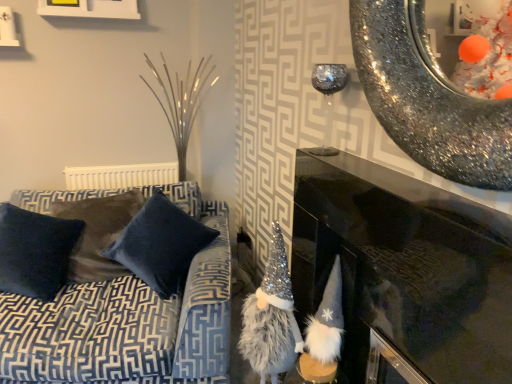
The width and height of the screenshot is (512, 384). Describe the element at coordinates (324, 333) in the screenshot. I see `white fluffy gnome at lower right` at that location.

In order to face velvet blue pillow at center, which is the 2th pillow from left to right, should I rotate leftwards or rightwards?

Turn left approximately 11.886 degrees to face it.

What do you see at coordinates (271, 318) in the screenshot? I see `fuzzy silver gnome at center` at bounding box center [271, 318].

I want to click on white plastic radiator at upper center, so click(x=120, y=176).

This screenshot has height=384, width=512. What are the coordinates of `sparkly metallic bowl at upper right` in the screenshot? It's located at (426, 98).

Is velvet dark blue pillow at left, the first pillow in the left-to-right sequence, bigger than velvet blue pillow at center, which is the 2th pillow from left to right?

No, velvet dark blue pillow at left, the first pillow in the left-to-right sequence, is not bigger than velvet blue pillow at center, which is the 2th pillow from left to right.

Is point (29, 231) farther from viewer compared to point (106, 253)?

That is False.

From a real-world perspective, is velvet dark blue pillow at left, the 2th pillow when ordered from right to left, under velvet blue pillow at center, the 1th pillow positioned from the right?

Yes.

You are a GUI agent. You are given a task and a screenshot of the screen. Output one action in this format:
    pyautogui.click(x=<x>, y=<y>)
    Task: Click on the pillow beneath the velvet blue pillow at center, which is the 2th pillow from left to right (from a real-world perspective)
    
    Given the screenshot: What is the action you would take?
    pyautogui.click(x=35, y=252)

This screenshot has width=512, height=384. Find the location of `oval above the white fluffy gnome at lower right (from the image's perspective)`. oval above the white fluffy gnome at lower right (from the image's perspective) is located at coordinates (426, 98).

Is sparkly metallic bowl at upper right a part of white fluffy gnome at lower right?

That's incorrect, sparkly metallic bowl at upper right is not inside white fluffy gnome at lower right.

Does white fluffy gnome at lower right touch sparkly metallic bowl at upper right?

No, white fluffy gnome at lower right is not making contact with sparkly metallic bowl at upper right.

Would you say velvet blue couch at left is outside velvet dark blue pillow at left, the 2th pillow when ordered from right to left?

Yes, velvet blue couch at left is outside of velvet dark blue pillow at left, the 2th pillow when ordered from right to left.

Is velvet blue couch at left taller or shorter than velvet dark blue pillow at left, the first pillow in the left-to-right sequence?

velvet blue couch at left is taller than velvet dark blue pillow at left, the first pillow in the left-to-right sequence.

Could you tell me if velvet blue couch at left is facing velvet dark blue pillow at left, the first pillow in the left-to-right sequence?

Yes, velvet blue couch at left is turned towards velvet dark blue pillow at left, the first pillow in the left-to-right sequence.

Measure the distance from velvet blue couch at left to velvet dark blue pillow at left, the first pillow in the left-to-right sequence.

velvet blue couch at left is 12.51 inches away from velvet dark blue pillow at left, the first pillow in the left-to-right sequence.

Which of these two, velvet blue couch at left or fuzzy silver gnome at center, is smaller?

With smaller size is fuzzy silver gnome at center.

From a real-world perspective, who is located higher, velvet blue couch at left or fuzzy silver gnome at center?

fuzzy silver gnome at center is physically above.

Considering the sizes of objects velvet blue couch at left and fuzzy silver gnome at center in the image provided, who is taller, velvet blue couch at left or fuzzy silver gnome at center?

Standing taller between the two is fuzzy silver gnome at center.

Can you tell me how much velvet blue couch at left and fuzzy silver gnome at center differ in facing direction?

velvet blue couch at left and fuzzy silver gnome at center are facing 73.4 degrees away from each other.

Looking at the image, does black glossy fireplace at center seem bigger or smaller compared to white fluffy gnome at lower right?

Considering their sizes, black glossy fireplace at center takes up more space than white fluffy gnome at lower right.

Is black glossy fireplace at center inside the boundaries of white fluffy gnome at lower right, or outside?

The correct answer is: outside.

Find the location of a particular element. The image size is (512, 384). fireplace on the right of white fluffy gnome at lower right is located at coordinates (406, 268).

In the scene shown: Is the depth of black glossy fireplace at center less than that of white fluffy gnome at lower right?

Yes, the depth of black glossy fireplace at center is less than that of white fluffy gnome at lower right.

Considering the sizes of objects sparkly metallic bowl at upper right and velvet dark blue pillow at left, the 2th pillow when ordered from right to left, in the image provided, who is bigger, sparkly metallic bowl at upper right or velvet dark blue pillow at left, the 2th pillow when ordered from right to left,?

With larger size is velvet dark blue pillow at left, the 2th pillow when ordered from right to left.

Could you measure the distance between sparkly metallic bowl at upper right and velvet dark blue pillow at left, the 2th pillow when ordered from right to left?

sparkly metallic bowl at upper right and velvet dark blue pillow at left, the 2th pillow when ordered from right to left, are 5.50 feet apart.

Is point (421, 116) closer to camera compared to point (33, 230)?

Yes.

In the scene shown: Which object is positioned more to the right, velvet dark blue pillow at left, the 2th pillow when ordered from right to left, or black glossy fireplace at center?

black glossy fireplace at center is more to the right.

Is velvet dark blue pillow at left, the 2th pillow when ordered from right to left, aimed at black glossy fireplace at center?

No.

Can you confirm if velvet dark blue pillow at left, the first pillow in the left-to-right sequence, is taller than black glossy fireplace at center?

No.

From the image's perspective, is velvet dark blue pillow at left, the first pillow in the left-to-right sequence, located above or below black glossy fireplace at center?

From the image's perspective, velvet dark blue pillow at left, the first pillow in the left-to-right sequence, appears above black glossy fireplace at center.

Where is `pillow in front of the velvet blue pillow at center, the 1th pillow positioned from the right`? pillow in front of the velvet blue pillow at center, the 1th pillow positioned from the right is located at coordinates pyautogui.click(x=35, y=252).

Locate an element on the screen. toy below the sparkly metallic bowl at upper right (from the image's perspective) is located at coordinates pyautogui.click(x=324, y=333).

Which object lies nearer to the anchor point velvet dark blue pillow at left, the first pillow in the left-to-right sequence, white fluffy gnome at lower right or velvet blue pillow at center, the 1th pillow positioned from the right?

velvet blue pillow at center, the 1th pillow positioned from the right, is positioned closer to the anchor velvet dark blue pillow at left, the first pillow in the left-to-right sequence.

When comparing their distances from fuzzy silver gnome at center, does white fluffy gnome at lower right or white plastic radiator at upper center seem further?

The object further to fuzzy silver gnome at center is white plastic radiator at upper center.

Looking at the image, which one is located further to white matte picture frame at upper left, black glossy fireplace at center or white plastic radiator at upper center?

black glossy fireplace at center is further to white matte picture frame at upper left.

Which object lies further to the anchor point velvet dark blue pillow at left, the 2th pillow when ordered from right to left, white plastic radiator at upper center or velvet blue pillow at center, the 1th pillow positioned from the right?

Based on the image, white plastic radiator at upper center appears to be further to velvet dark blue pillow at left, the 2th pillow when ordered from right to left.

Estimate the real-world distances between objects in this image. Which object is closer to white fluffy gnome at lower right, black glossy fireplace at center or velvet dark blue pillow at left, the 2th pillow when ordered from right to left?

black glossy fireplace at center.

Looking at this image, considering their positions, is white plastic radiator at upper center positioned further to black glossy fireplace at center than velvet blue pillow at center, the 1th pillow positioned from the right?

Among the two, white plastic radiator at upper center is located further to black glossy fireplace at center.

Considering their positions, is white plastic radiator at upper center positioned closer to velvet dark blue pillow at left, the first pillow in the left-to-right sequence, than white matte picture frame at upper left?

white plastic radiator at upper center is positioned closer to the anchor velvet dark blue pillow at left, the first pillow in the left-to-right sequence.

Looking at the image, which one is located closer to white plastic radiator at upper center, black glossy fireplace at center or white matte picture frame at upper left?

Among the two, white matte picture frame at upper left is located nearer to white plastic radiator at upper center.

In order to click on studio couch located between white fluffy gnome at lower right and white plastic radiator at upper center in the depth direction in this screenshot , I will do `click(128, 320)`.

In order to click on picture frame located between black glossy fireplace at center and white plastic radiator at upper center in the depth direction in this screenshot , I will do click(90, 8).

I want to click on oval between black glossy fireplace at center and fuzzy silver gnome at center along the z-axis, so point(426,98).

Where is `toy between velvet blue couch at left and sparkly metallic bowl at upper right in the horizontal direction`? The height and width of the screenshot is (384, 512). toy between velvet blue couch at left and sparkly metallic bowl at upper right in the horizontal direction is located at coordinates (324, 333).